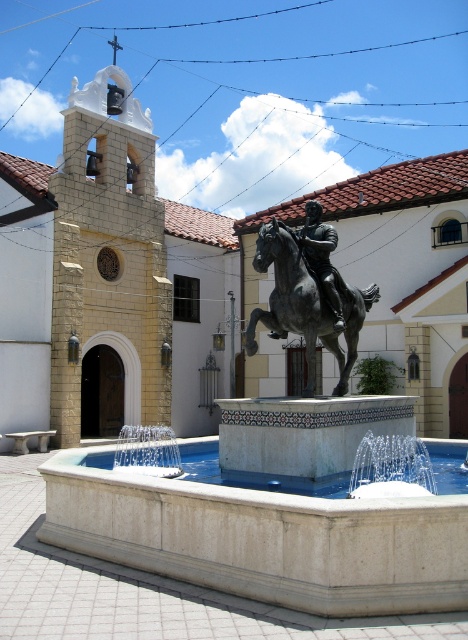
Consider the image. You are standing in the square and want to take a photo of both the white stone fountain at center and the white marble fountain at center. Which fountain should you move closer to in order to capture both in the same frame?

You should move closer to the white marble fountain at center because it is farther away than the white stone fountain at center, so moving closer to it will help include both in the frame.

You are standing in front of the fountain and want to touch the statue. Which object should you reach towards first, the bronze metallic horse at center or the polished bronze statue at center?

You should reach towards the bronze metallic horse at center first because it is closer to you than the polished bronze statue at center.

You are an artist planning to sketch the fountain scene. You have a canvas that can only accommodate objects up to 2 meters in width. You see the bronze metallic horse at center and the polished bronze statue at center. Which object should you choose to ensure it fits on your canvas?

The polished bronze statue at center has a smaller width than the bronze metallic horse at center, so it will fit better on the 2 meter canvas.